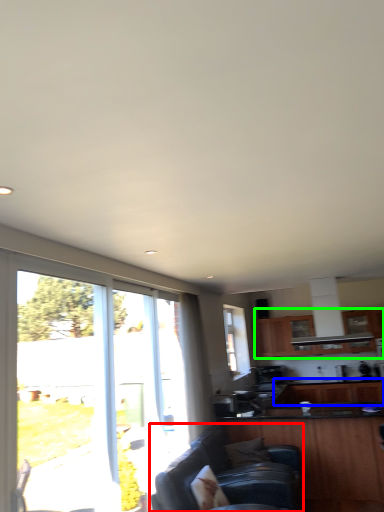
Question: Which object is the farthest from studio couch (highlighted by a red box)? Choose among these: cabinetry (highlighted by a blue box) or cabinetry (highlighted by a green box).

Choices:
 (A) cabinetry
 (B) cabinetry

Answer: (B)